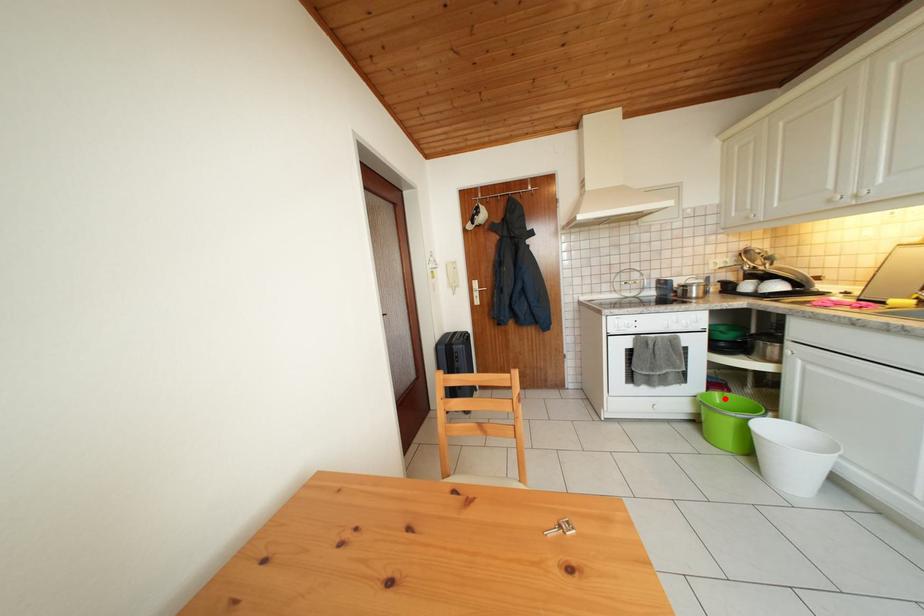
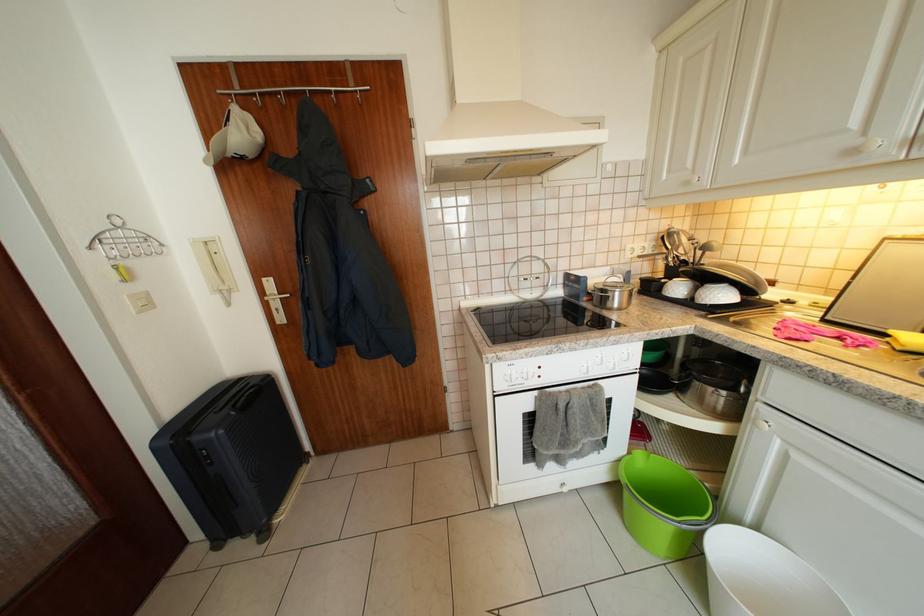
In the second image, find the point that corresponds to the highlighted location in the first image.

(648, 459)